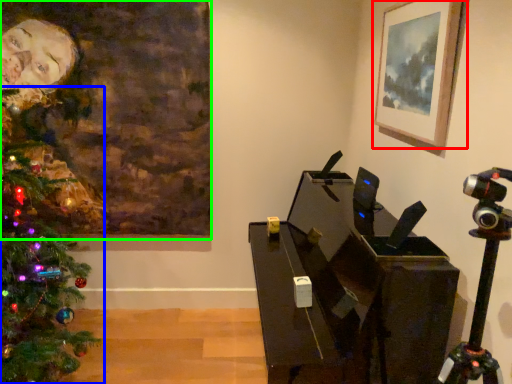
Question: Considering the real-world distances, which object is farthest from picture frame (highlighted by a red box)? christmas tree (highlighted by a blue box) or picture frame (highlighted by a green box)?

Choices:
 (A) christmas tree
 (B) picture frame

Answer: (A)